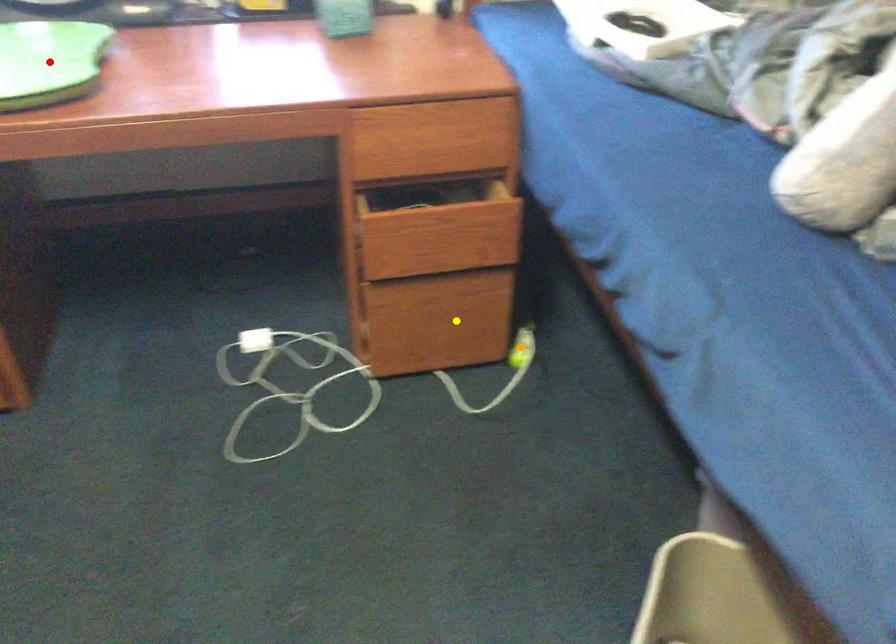
Order these from nearest to farthest:
red point, yellow point, orange point

1. red point
2. yellow point
3. orange point